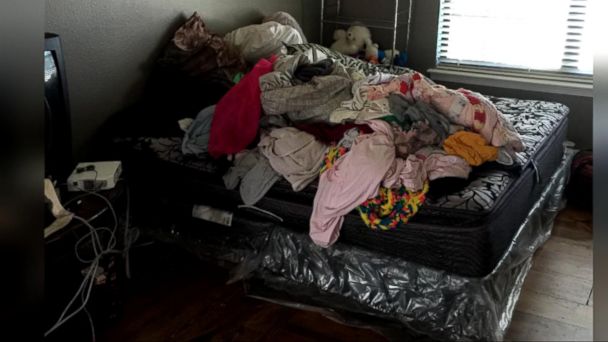
Where is `plastic mattress covering`? The image size is (608, 342). plastic mattress covering is located at coordinates (395, 286).